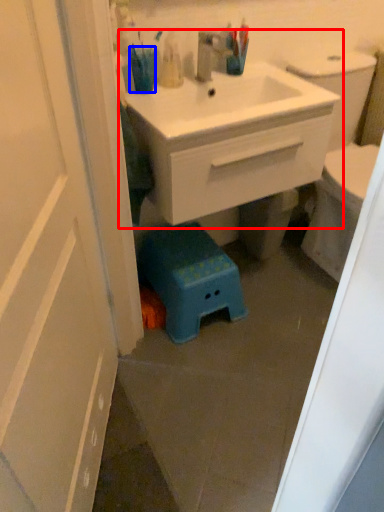
Question: Which object is further to the camera taking this photo, bathroom cabinet (highlighted by a red box) or teal (highlighted by a blue box)?

Choices:
 (A) bathroom cabinet
 (B) teal

Answer: (B)